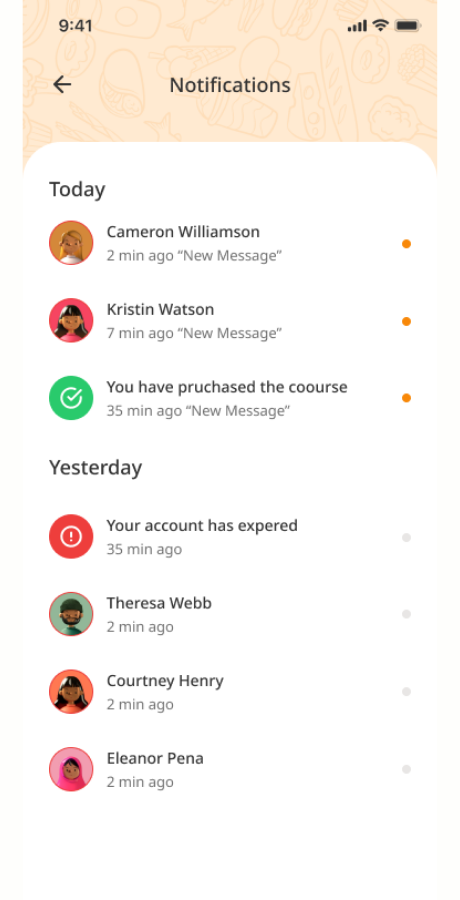
Where is `wifi`? The image size is (460, 900). wifi is located at coordinates (379, 22).